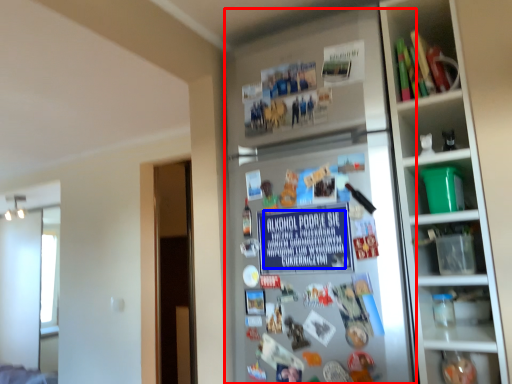
Question: Which point is further to the camera, fridge (highlighted by a red box) or writing (highlighted by a blue box)?

Choices:
 (A) fridge
 (B) writing

Answer: (B)